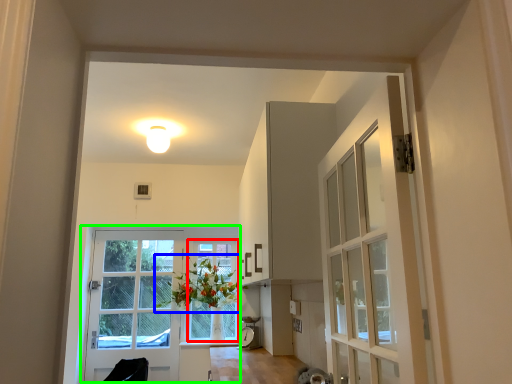
Question: Based on their relative distances, which object is farther from window frame (highlighted by a red box)? Choose from floral arrangement (highlighted by a blue box) and door (highlighted by a green box).

Choices:
 (A) floral arrangement
 (B) door

Answer: (B)